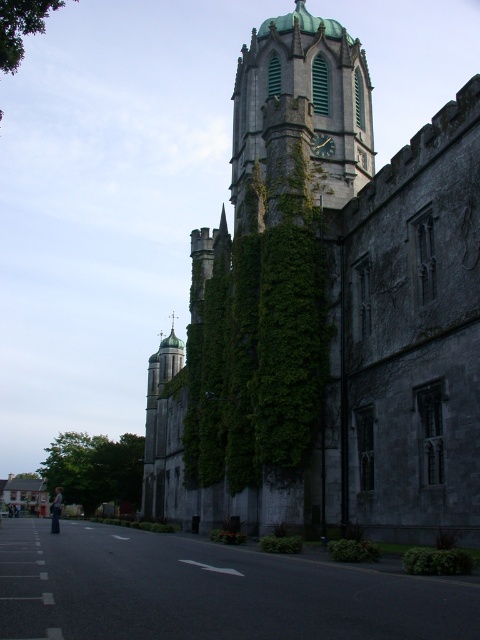
Question: Is green leafy tree at lower left closer to the viewer compared to dark brown wooden clock at center?

Choices:
 (A) yes
 (B) no

Answer: (B)

Question: In this image, where is gray stone castle at center located relative to dark brown wooden clock at center?

Choices:
 (A) right
 (B) left

Answer: (B)

Question: Which point is farther from the camera taking this photo?

Choices:
 (A) (313, 145)
 (B) (205, 326)
 (C) (14, 67)

Answer: (B)

Question: Observing the image, what is the correct spatial positioning of gray stone castle at center in reference to green stone clock tower at upper center?

Choices:
 (A) left
 (B) right

Answer: (A)

Question: Which of the following is the closest to the observer?

Choices:
 (A) gray stone castle at center
 (B) dark brown wooden clock at center
 (C) green leafy tree at lower left
 (D) green stone clock tower at upper center

Answer: (A)

Question: Estimate the real-world distances between objects in this image. Which object is closer to the green leafy tree at lower left?

Choices:
 (A) green leafy tree at upper left
 (B) gray stone castle at center

Answer: (B)